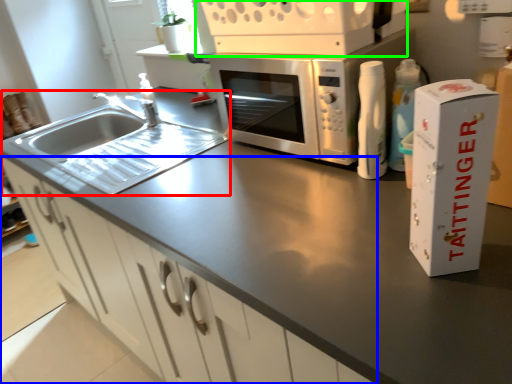
Question: Considering the real-world distances, which object is farthest from sink (highlighted by a red box)? cabinetry (highlighted by a blue box) or appliance (highlighted by a green box)?

Choices:
 (A) cabinetry
 (B) appliance

Answer: (B)